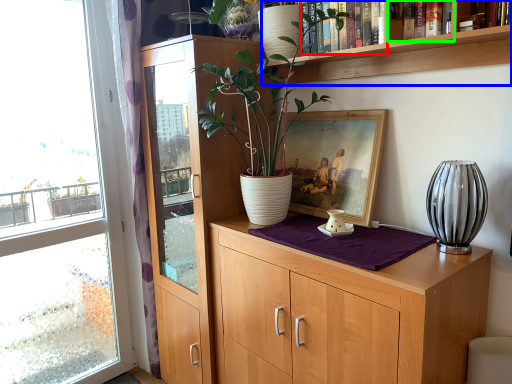
Question: Based on their relative distances, which object is nearer to book (highlighted by a red box)? Choose from shelf (highlighted by a blue box) and book (highlighted by a green box).

Choices:
 (A) shelf
 (B) book

Answer: (A)